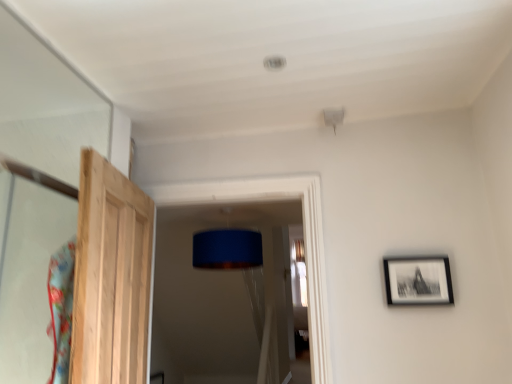
Question: Should I look upward or downward to see natural wood door at left?

Choices:
 (A) up
 (B) down

Answer: (B)

Question: From the image's perspective, is black matte picture frame at right above natural wood door at left?

Choices:
 (A) no
 (B) yes

Answer: (A)

Question: Is the position of black matte picture frame at right more distant than that of natural wood door at left?

Choices:
 (A) no
 (B) yes

Answer: (B)

Question: From the image's perspective, is black matte picture frame at right located beneath natural wood door at left?

Choices:
 (A) no
 (B) yes

Answer: (B)

Question: Does black matte picture frame at right appear on the left side of natural wood door at left?

Choices:
 (A) yes
 (B) no

Answer: (B)

Question: Can you confirm if black matte picture frame at right is bigger than natural wood door at left?

Choices:
 (A) no
 (B) yes

Answer: (A)

Question: Is black matte picture frame at right positioned with its back to natural wood door at left?

Choices:
 (A) yes
 (B) no

Answer: (B)

Question: Is natural wood door at left thinner than black matte picture frame at right?

Choices:
 (A) no
 (B) yes

Answer: (A)

Question: Is black matte picture frame at right a part of natural wood door at left?

Choices:
 (A) yes
 (B) no

Answer: (B)

Question: Is natural wood door at left facing away from black matte picture frame at right?

Choices:
 (A) no
 (B) yes

Answer: (A)

Question: Is natural wood door at left positioned behind black matte picture frame at right?

Choices:
 (A) yes
 (B) no

Answer: (B)

Question: From a real-world perspective, is natural wood door at left under black matte picture frame at right?

Choices:
 (A) no
 (B) yes

Answer: (A)

Question: Is natural wood door at left oriented towards black matte picture frame at right?

Choices:
 (A) no
 (B) yes

Answer: (B)

Question: Considering the relative positions of natural wood door at left and black matte picture frame at right in the image provided, is natural wood door at left to the left or to the right of black matte picture frame at right?

Choices:
 (A) left
 (B) right

Answer: (A)